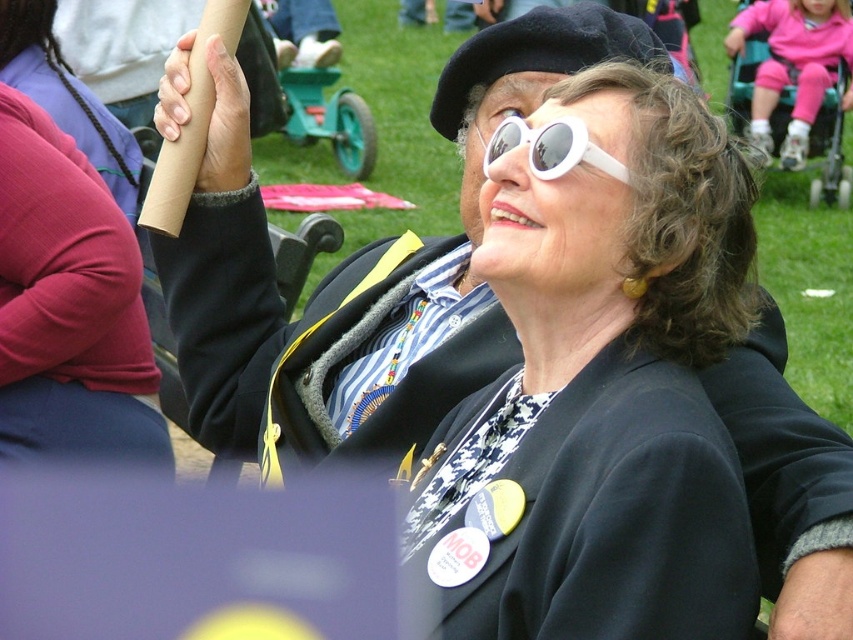
Who is more forward, (643, 488) or (582, 150)?

Point (643, 488)

Does point (627, 204) come closer to viewer compared to point (548, 154)?

No, it is not.

Image resolution: width=853 pixels, height=640 pixels. Find the location of `white matte sunglasses at upper center`. white matte sunglasses at upper center is located at coordinates (599, 381).